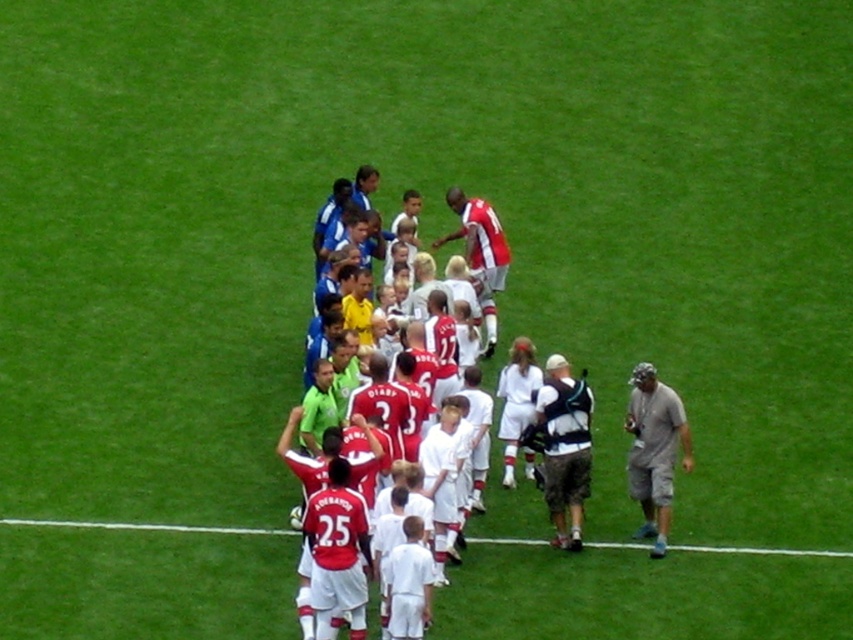
You are a photographer trying to capture a closeup shot of the gray fabric cap at lower right and the white fabric at lower center. Since you want both objects in focus, you need to know their relative sizes. Which object is bigger?

The gray fabric cap at lower right has a larger size compared to white fabric at lower center, so you should focus on the gray fabric cap at lower right first as it is bigger.

You are a photographer trying to capture a closeup of the gray fabric cap at lower right and the white fabric at lower center. Since you want both items to appear similarly sized in the photo, which object should you move closer to the camera?

Since the gray fabric cap at lower right is wider than the white fabric at lower center, you should move the gray fabric cap at lower right closer to the camera to make it appear the same size as the white fabric at lower center in the photo.